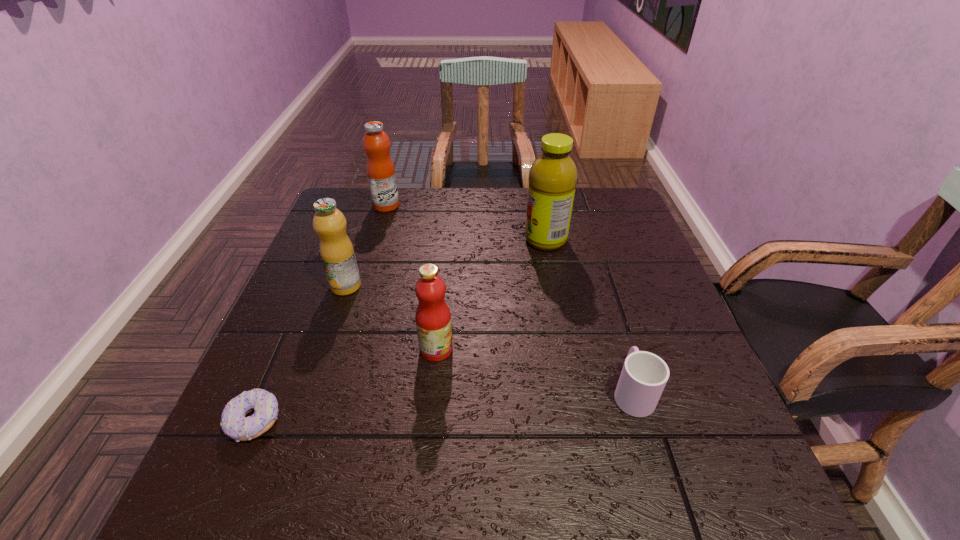
Where is `the second farthest object`? the second farthest object is located at coordinates (553, 175).

Identify the location of the rightmost fruit juice. The image size is (960, 540). (553, 175).

You are a GUI agent. You are given a task and a screenshot of the screen. Output one action in this format:
    pyautogui.click(x=<x>, y=<y>)
    Task: Click on the farthest fruit juice
    
    Given the screenshot: What is the action you would take?
    pyautogui.click(x=380, y=169)

Where is `the second nearest fruit juice`? The height and width of the screenshot is (540, 960). the second nearest fruit juice is located at coordinates (336, 250).

Where is `the third fruit juice from left to right`? This screenshot has height=540, width=960. the third fruit juice from left to right is located at coordinates click(433, 318).

This screenshot has height=540, width=960. I want to click on the fourth farthest object, so click(433, 318).

Identify the location of cup. The image size is (960, 540). (644, 375).

The height and width of the screenshot is (540, 960). I want to click on the rightmost object, so click(644, 375).

Where is `doughnut`? This screenshot has width=960, height=540. doughnut is located at coordinates (234, 423).

Locate an element on the screen. vacant region located on the front label of the second farthest object is located at coordinates (389, 240).